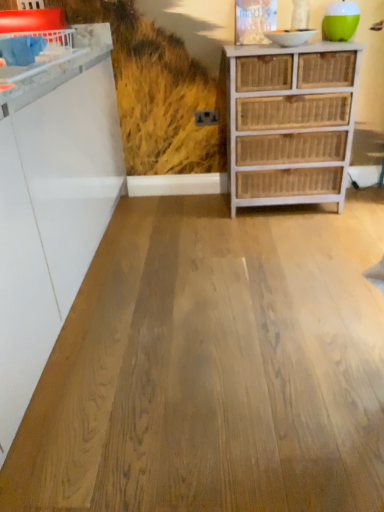
Find the location of a particular element. This screenshot has height=512, width=384. free space to the left of white wicker chest of drawers at right is located at coordinates (195, 218).